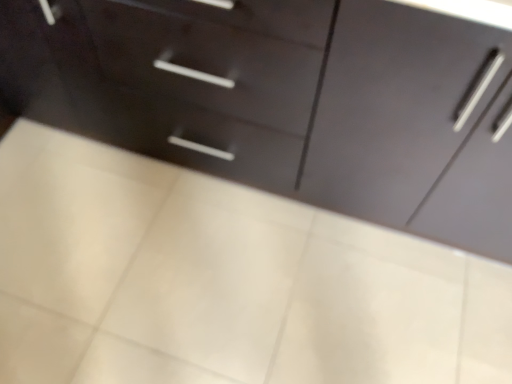
In order to face matte black cabinet at upper center, should I rotate leftwards or rightwards?

You should rotate left by 7.778 degrees.

Where is `matte black cabinet at upper center`? matte black cabinet at upper center is located at coordinates (290, 99).

What is the approximate width of matte black cabinet at upper center?

25.43 inches.

Describe the element at coordinates (290, 99) in the screenshot. I see `matte black cabinet at upper center` at that location.

Locate an element on the screen. This screenshot has width=512, height=384. matte black cabinet at upper center is located at coordinates pos(290,99).